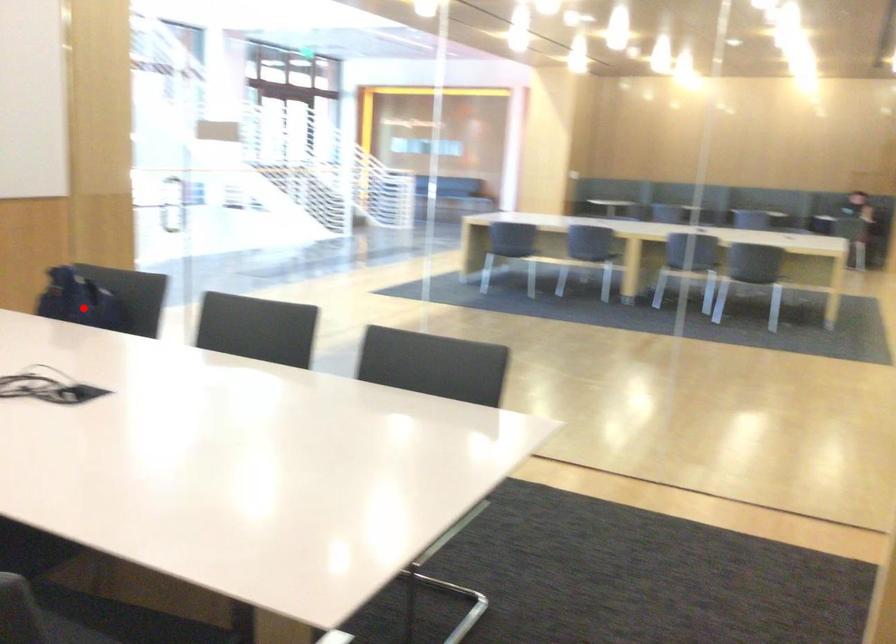
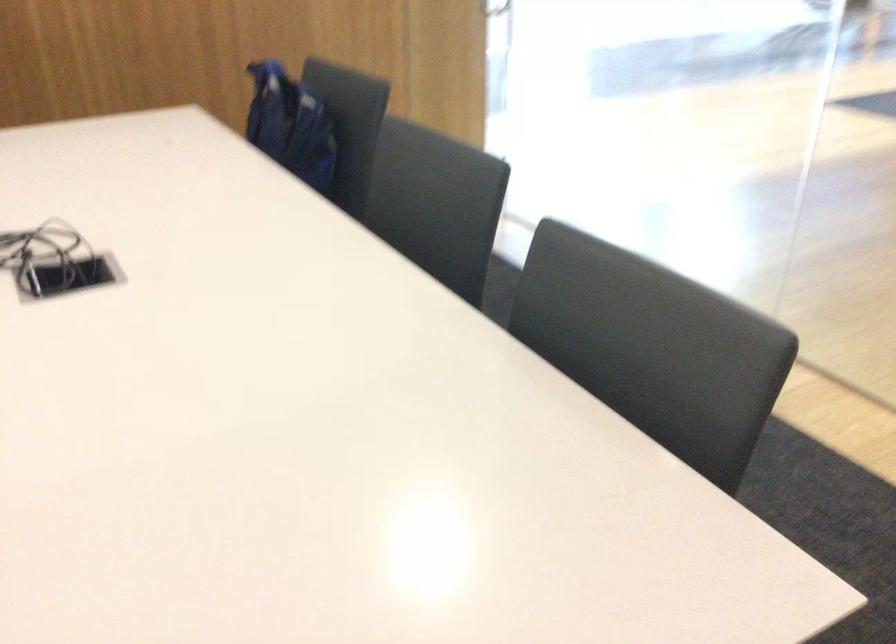
Question: I am providing you with two images of the same scene from different viewpoints. Given a red point in image1, look at the same physical point in image2. Is it:

Choices:
 (A) Closer to the viewpoint
 (B) Farther from the viewpoint

Answer: (A)